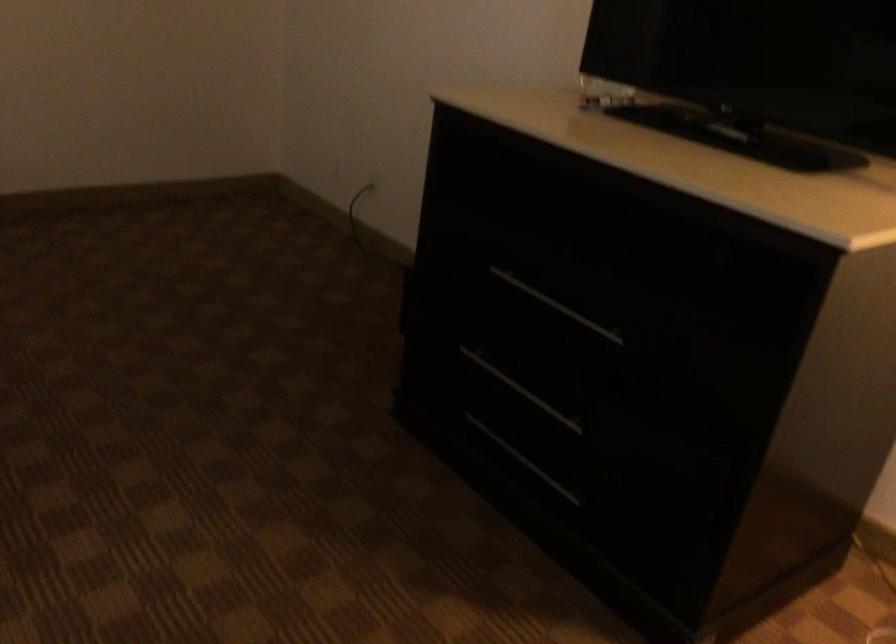
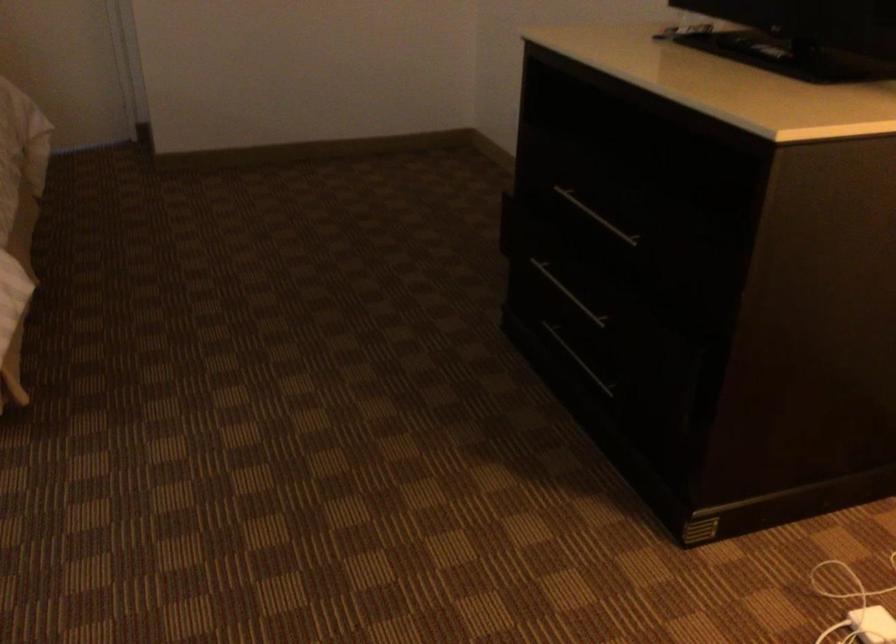
Question: The camera is either moving clockwise (left) or counter-clockwise (right) around the object. The first image is from the beginning of the video and the second image is from the end. Is the camera moving left or right when shooting the video?

Choices:
 (A) Left
 (B) Right

Answer: (B)